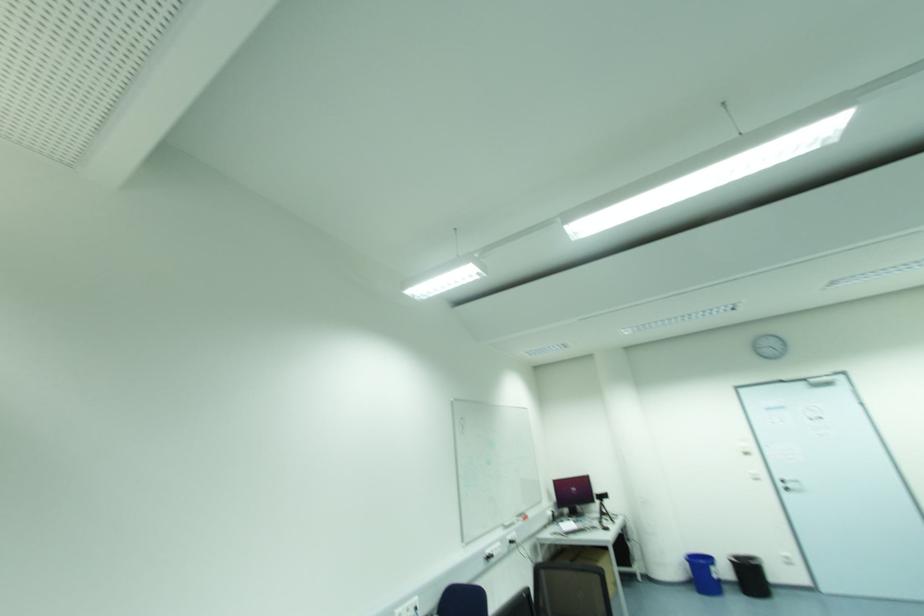
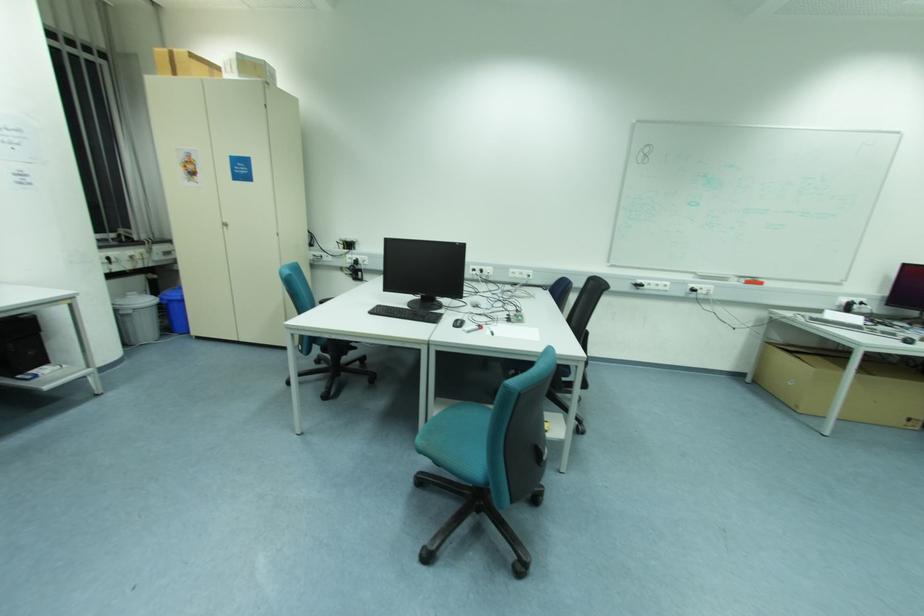
Find the pixel in the second image that matches pixel 528 517 in the first image.

(761, 284)